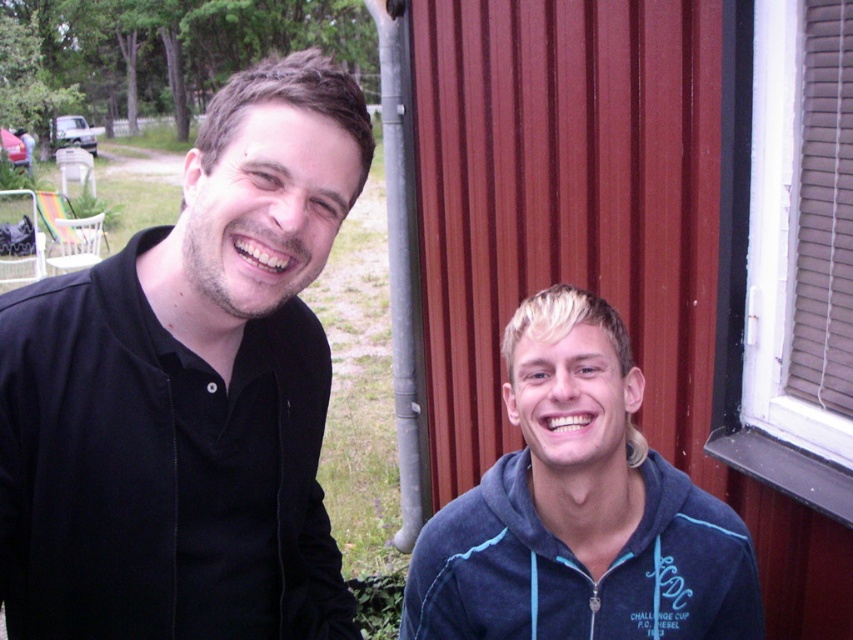
You are standing at the origin of a coordinate system placed at the bottom left corner of the image. The black matte shirt at left is marked by a point at coordinate (x=189, y=392). If you want to walk directly towards the black matte shirt at left, in which direction should you move?

To move directly towards the black matte shirt at left located at coordinate (x=189, y=392) from the origin at the bottom left corner, you should move diagonally to the upper right direction. This is because the x and y coordinates of the point are both greater than zero, indicating the position is to the right and above the origin.

You are a photographer trying to capture a group photo of the black matte shirt at left and the blue fleece sweatshirt at lower right. To ensure both are in focus, you need to know their heights. Which one is taller?

The black matte shirt at left is taller than the blue fleece sweatshirt at lower right according to the description.